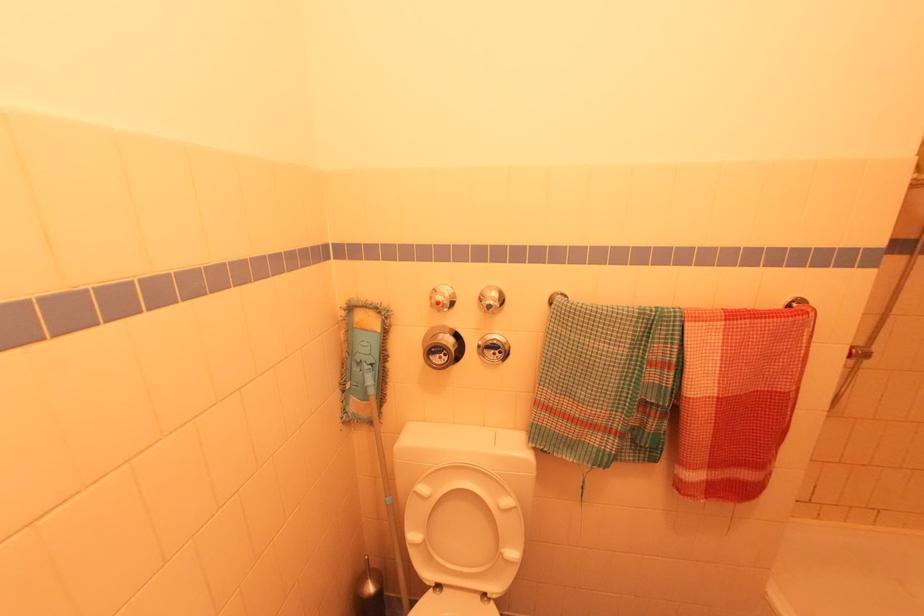
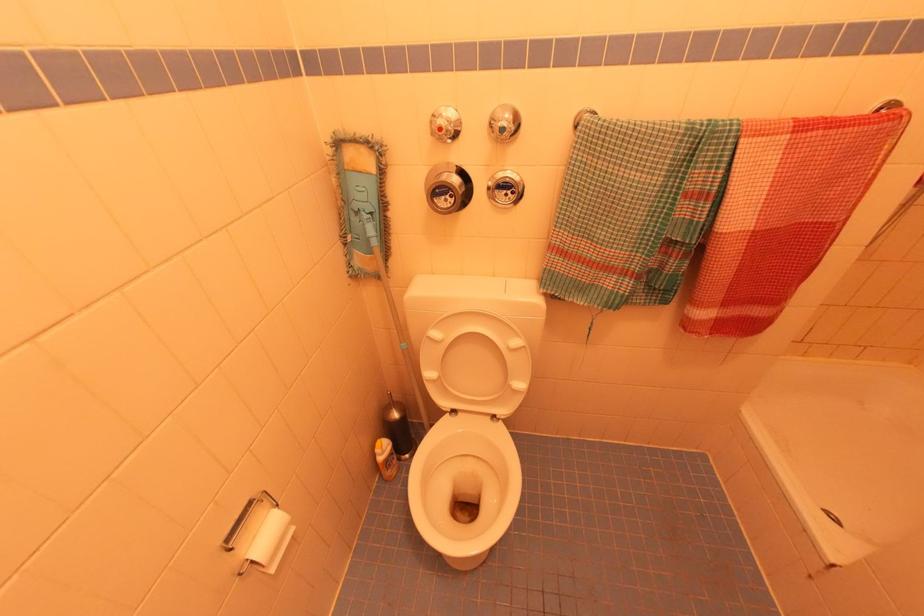
The point at (738, 313) is marked in the first image. Where is the corresponding point in the second image?

(812, 122)